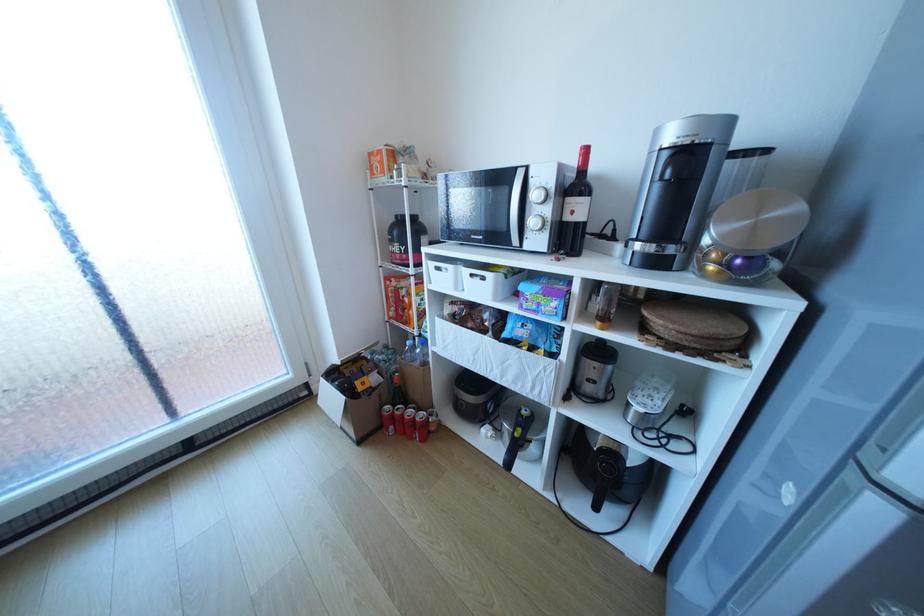
This screenshot has width=924, height=616. Identify the location of microwave handle. (516, 206).